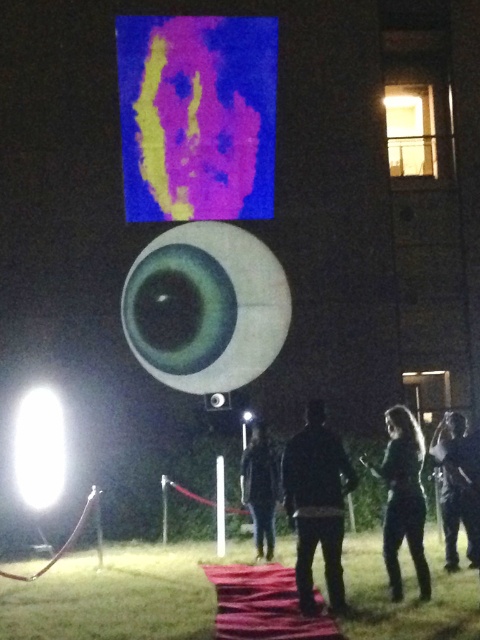
Question: Can you confirm if dark green leather jacket at lower center is positioned above dark fabric jacket at center?

Choices:
 (A) yes
 (B) no

Answer: (A)

Question: Is purple felt-like screen at upper center thinner than black matte jacket at center?

Choices:
 (A) yes
 (B) no

Answer: (B)

Question: Which point is farther to the camera?

Choices:
 (A) dark fabric jacket at center
 (B) dark green leather jacket at lower center
 (C) black matte jacket at center
 (D) dark gray hoodie at center

Answer: (A)

Question: Does purple felt-like screen at upper center appear over dark gray hoodie at center?

Choices:
 (A) yes
 (B) no

Answer: (A)

Question: Which point appears farthest from the camera in this image?

Choices:
 (A) (151, 48)
 (B) (275, 472)
 (C) (445, 486)
 (D) (314, 419)

Answer: (A)

Question: Which of the following is the farthest from the observer?

Choices:
 (A) (446, 500)
 (B) (195, 136)

Answer: (B)